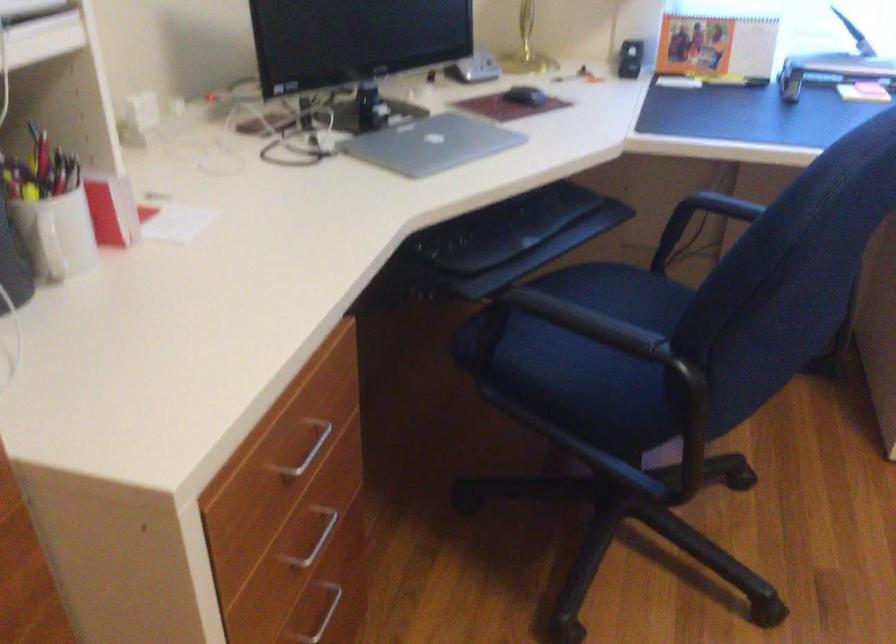
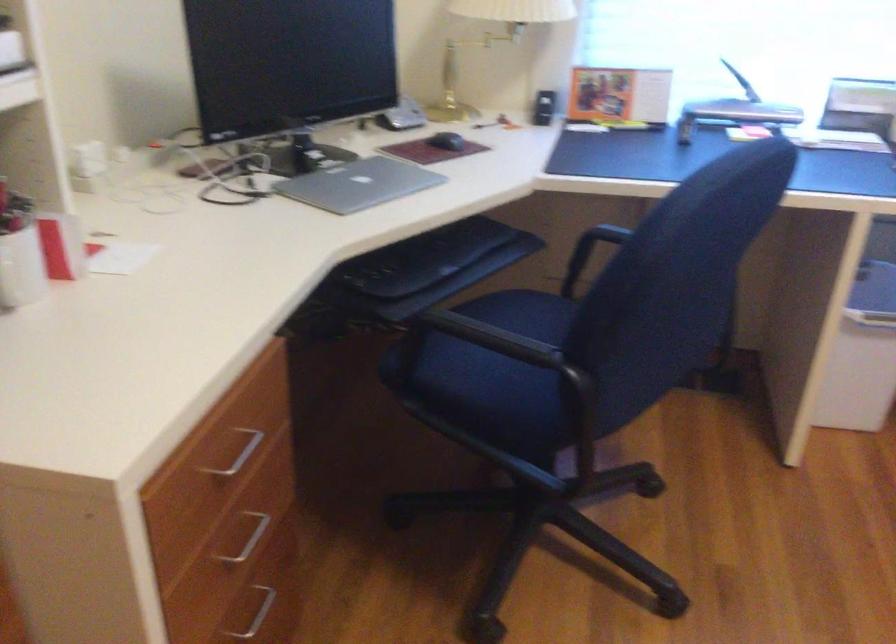
Where in the second image is the point corresponding to (524,97) from the first image?

(446, 140)